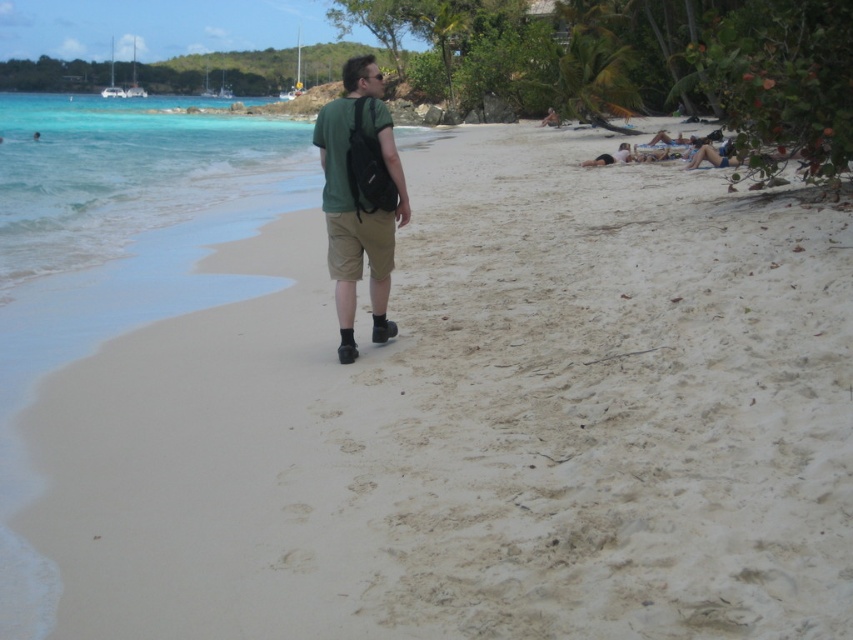
Is green matte t-shirt at center shorter than smooth tan skin at upper right?

Incorrect, green matte t-shirt at center's height does not fall short of smooth tan skin at upper right's.

Is point (328, 177) closer to camera compared to point (701, 157)?

That is True.

Where is `green matte t-shirt at center`? green matte t-shirt at center is located at coordinates (358, 196).

Between smooth tan skin at upper right and matte black shirt at center, which one is positioned higher?

matte black shirt at center is higher up.

Does smooth tan skin at upper right have a lesser width compared to matte black shirt at center?

In fact, smooth tan skin at upper right might be wider than matte black shirt at center.

Between point (718, 164) and point (625, 145), which one is positioned in front?

Positioned in front is point (718, 164).

I want to click on smooth tan skin at upper right, so click(x=714, y=156).

Is point (389, 160) in front of point (547, 118)?

Yes.

Is green matte t-shirt at center positioned in front of matte green t-shirt at upper center?

That is True.

Find the location of a particular element. green matte t-shirt at center is located at coordinates (358, 196).

Locate an element on the screen. green matte t-shirt at center is located at coordinates (358, 196).